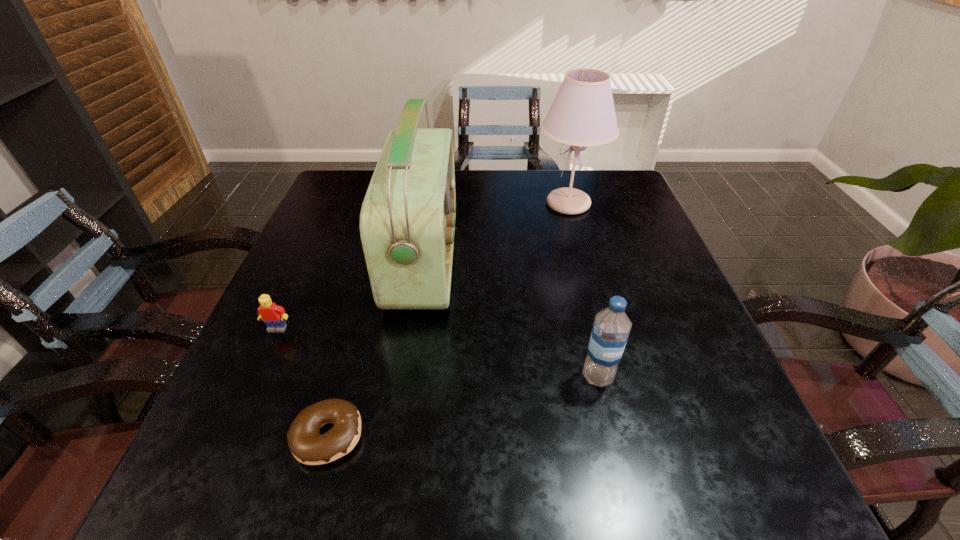
This screenshot has height=540, width=960. In order to click on vacant point located between the lampshade and the nearest object in this screenshot , I will do (x=448, y=320).

You are a GUI agent. You are given a task and a screenshot of the screen. Output one action in this format:
    pyautogui.click(x=<x>, y=<y>)
    Task: Click on the empty space that is in between the lampshade and the shortest object
    
    Given the screenshot: What is the action you would take?
    pyautogui.click(x=448, y=320)

Image resolution: width=960 pixels, height=540 pixels. Identify the location of empty space between the radio receiver and the third tallest object. (511, 318).

In order to click on free space between the radio receiver and the Lego in this screenshot , I will do `click(350, 294)`.

Identify the location of free space between the lampshade and the doughnut. The width and height of the screenshot is (960, 540). (448, 320).

What are the coordinates of `vacant region between the lampshade and the shortest object` in the screenshot? It's located at (448, 320).

This screenshot has width=960, height=540. I want to click on unoccupied position between the radio receiver and the lampshade, so click(x=496, y=232).

This screenshot has height=540, width=960. I want to click on object that is the third closest one to the nearest object, so click(611, 328).

Point out which object is positioned as the nearest to the radio receiver. Please provide its 2D coordinates. Your answer should be formatted as a tuple, i.e. [(x, y)], where the tuple contains the x and y coordinates of a point satisfying the conditions above.

[(273, 315)]

Image resolution: width=960 pixels, height=540 pixels. Find the location of `blank space that satisfies the following two spatial constraints: 1. on the front panel of the radio receiver; 2. on the front-facing side of the leftmost object`. blank space that satisfies the following two spatial constraints: 1. on the front panel of the radio receiver; 2. on the front-facing side of the leftmost object is located at coordinates (414, 328).